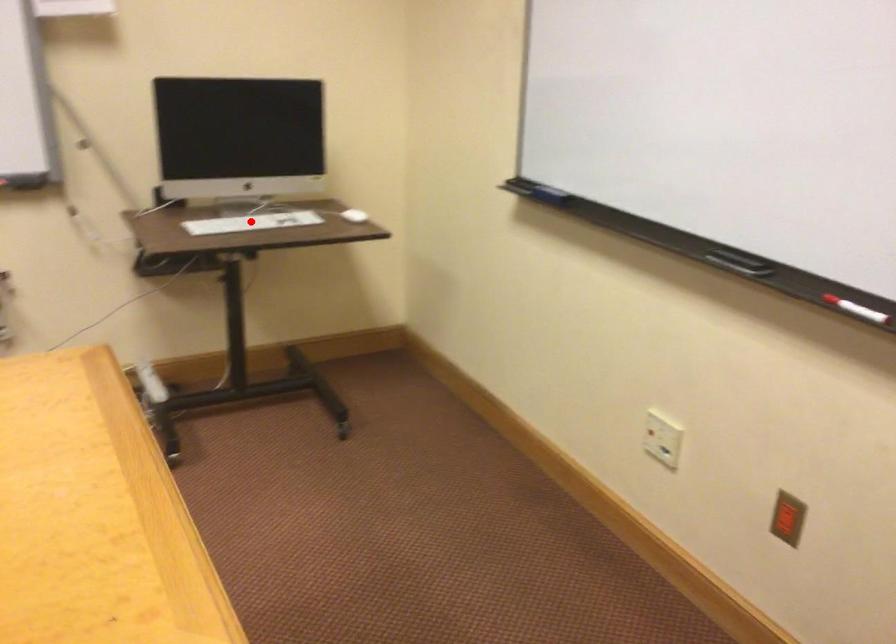
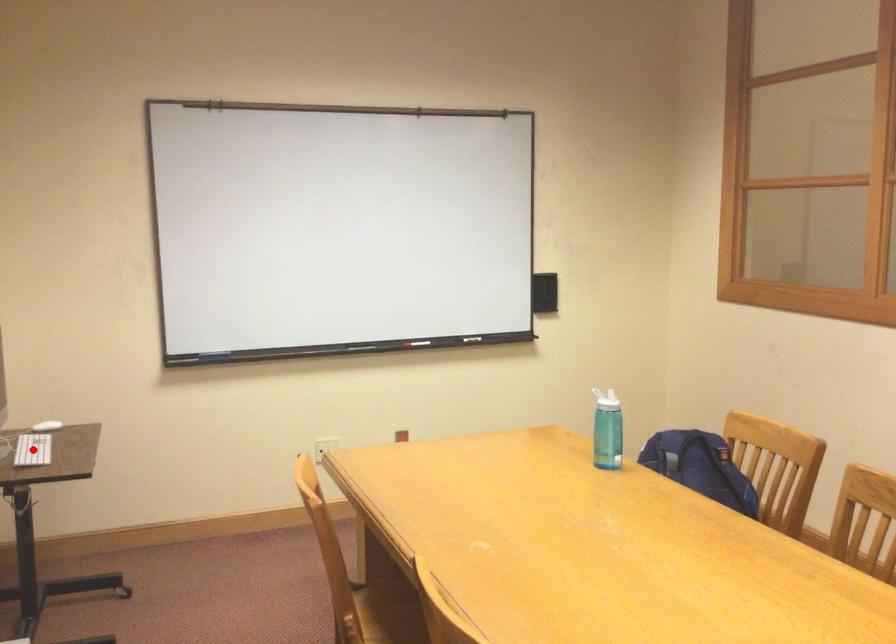
I am providing you with two images of the same scene from different viewpoints. A red point is marked on the first image and another point is marked on the second image. Do the highlighted points in image1 and image2 indicate the same real-world spot?

Yes